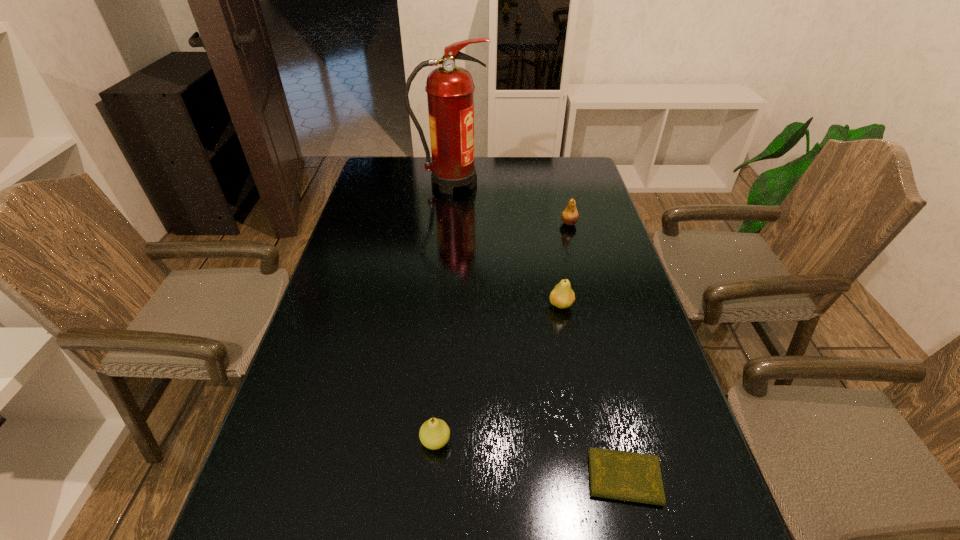
Locate an element on the screen. The width and height of the screenshot is (960, 540). vacant space located on the back of the second farthest object is located at coordinates (562, 194).

Identify the location of blank space located 0.200m on the front of the second farthest pear. (575, 379).

This screenshot has width=960, height=540. Identify the location of blank space located 0.200m on the right of the leftmost pear. (550, 441).

The width and height of the screenshot is (960, 540). I want to click on free spot located on the left of the diary, so click(x=423, y=478).

I want to click on object situated at the far edge, so click(x=450, y=89).

The width and height of the screenshot is (960, 540). What are the coordinates of `pear situated at the right edge` in the screenshot? It's located at (570, 216).

Where is `diary situated at the right edge`? This screenshot has height=540, width=960. diary situated at the right edge is located at coordinates (620, 475).

What are the coordinates of `vacant space at the far edge` in the screenshot? It's located at (520, 177).

The image size is (960, 540). In the image, there is a desktop. In order to click on vacant space at the left edge in this screenshot , I will do `click(318, 390)`.

In the image, there is a desktop. Where is `blank space at the right edge`? The image size is (960, 540). blank space at the right edge is located at coordinates (560, 205).